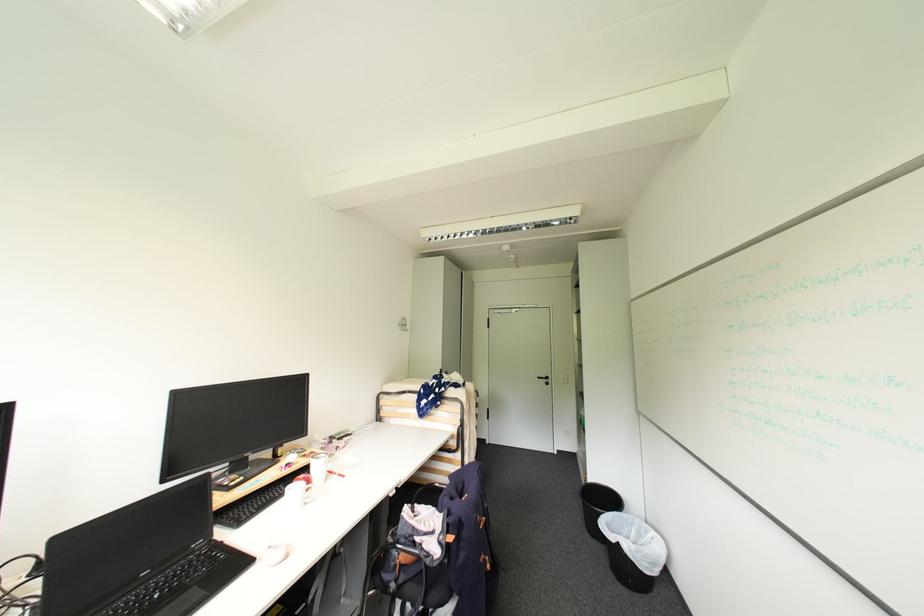
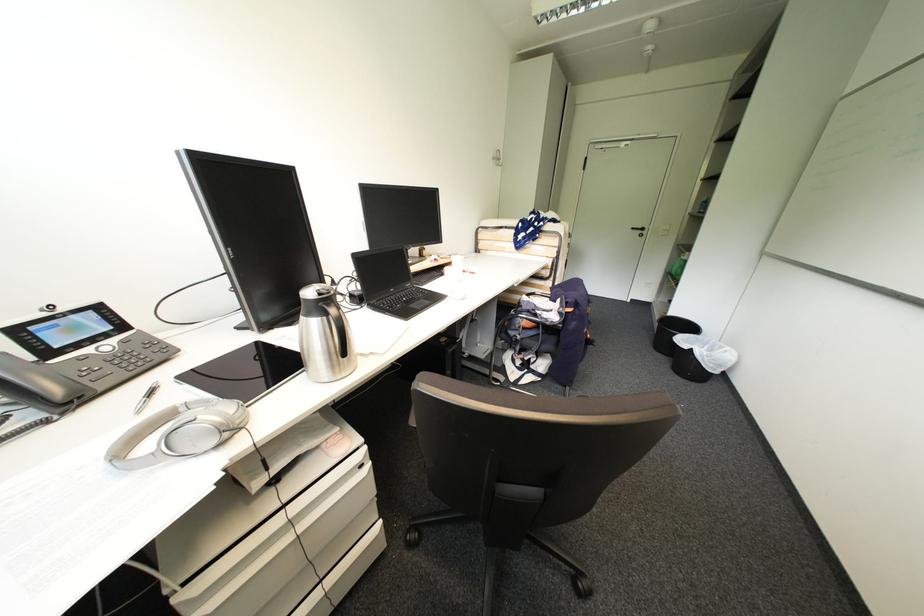
The point at (553, 381) is marked in the first image. Where is the corresponding point in the second image?

(648, 233)